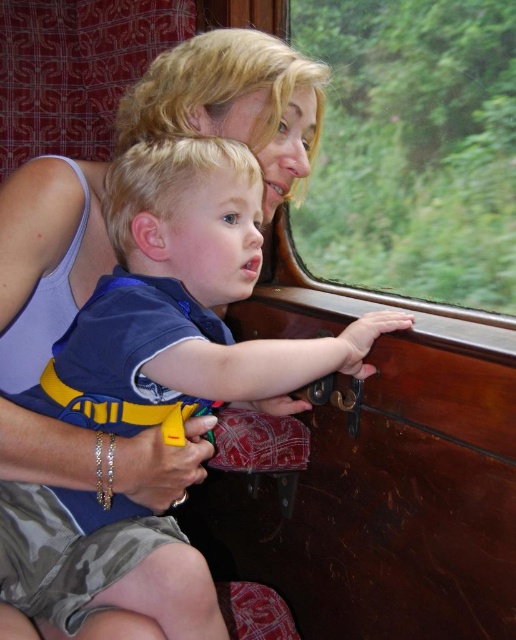
Is blue cotton shirt at center bigger than transparent glass window at upper center?

Yes.

Can you confirm if blue cotton shirt at center is thinner than transparent glass window at upper center?

No.

Measure the distance between blue cotton shirt at center and camera.

blue cotton shirt at center and camera are 59.90 centimeters apart from each other.

Locate an element on the screen. blue cotton shirt at center is located at coordinates (183, 298).